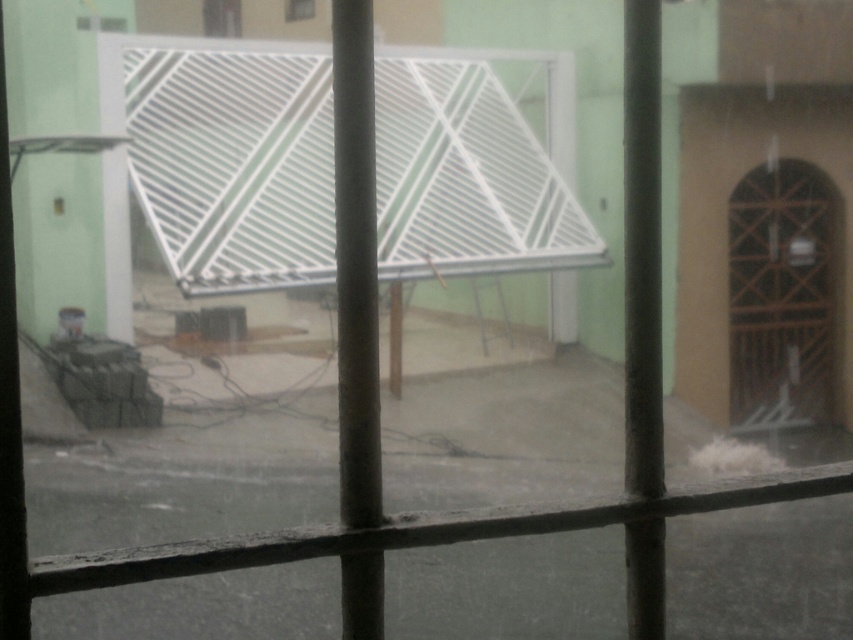
You are an interior designer assessing the view from a client room. You see the white matte grill at center and the brown wooden door at right. Which object occupies more horizontal space in the scene?

The white matte grill at center has a greater width than the brown wooden door at right, so it occupies more horizontal space in the scene.

You are standing at the window inside the building and want to estimate how far the white matte grill at center is from you. Based on the scene, can you determine the distance?

The white matte grill at center is 15.11 meters away from the viewer.

You are an architect assessing a construction site. You notice the white matte grill at center and the brown wooden door at right. Which object is shorter in height?

The white matte grill at center is shorter than the brown wooden door at right.